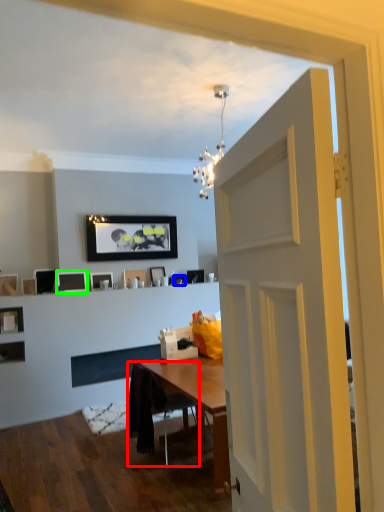
Question: Which object is the farthest from chair (highlighted by a red box)? Choose among these: picture frame (highlighted by a blue box) or picture frame (highlighted by a green box).

Choices:
 (A) picture frame
 (B) picture frame

Answer: (A)